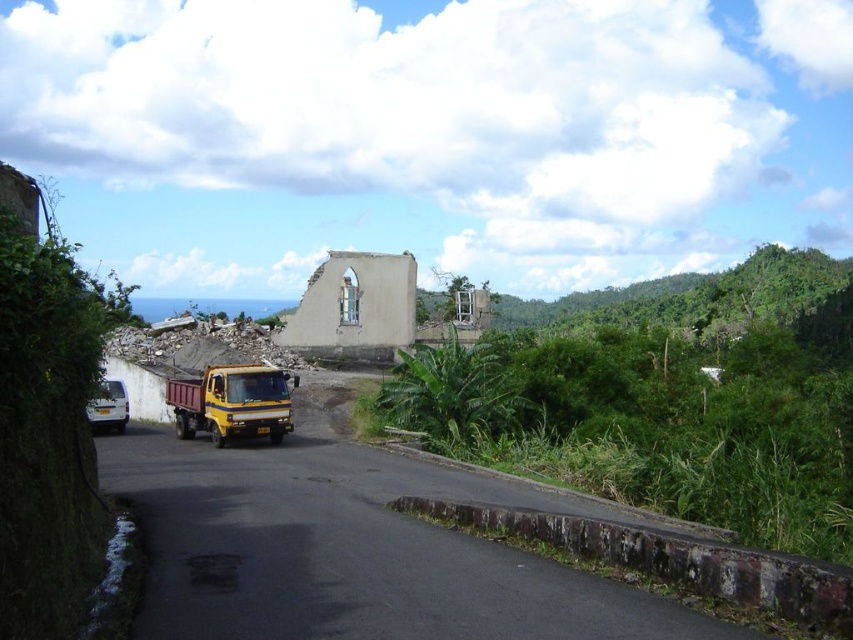
Which is behind, point (693, 474) or point (276, 419)?

The point (276, 419) is behind.

In the scene shown: Is green leafy vegetation at center right positioned behind yellow matte truck at center?

No, green leafy vegetation at center right is in front of yellow matte truck at center.

Is point (796, 282) closer to viewer compared to point (234, 433)?

No.

The height and width of the screenshot is (640, 853). In order to click on green leafy vegetation at center right in this screenshot , I will do `click(668, 401)`.

Is point (582, 403) positioned after point (96, 406)?

Yes, it is behind point (96, 406).

Is point (773, 484) farther from viewer compared to point (103, 401)?

No, (773, 484) is in front of (103, 401).

At what (x,y) coordinates should I click in order to perform the action: click on green leafy vegetation at center right. Please return your answer as a coordinate pair (x, y). Looking at the image, I should click on (668, 401).

Who is positioned more to the right, yellow matte truck at center or white matte van at left?

yellow matte truck at center

Can you confirm if yellow matte truck at center is positioned below white matte van at left?

Incorrect, yellow matte truck at center is not positioned below white matte van at left.

Is point (270, 378) closer to viewer compared to point (123, 413)?

Yes, it is.

The width and height of the screenshot is (853, 640). Find the location of `yellow matte truck at center`. yellow matte truck at center is located at coordinates (231, 403).